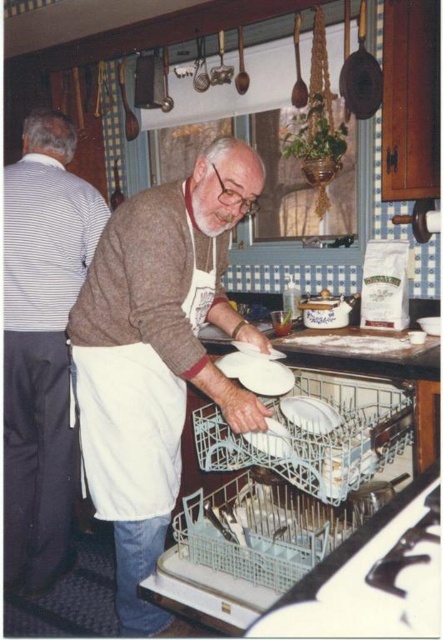
Is the position of white apron at left more distant than that of clear plastic dish washer at lower center?

That is True.

Does white apron at left have a lesser height compared to clear plastic dish washer at lower center?

No, white apron at left is not shorter than clear plastic dish washer at lower center.

The width and height of the screenshot is (443, 640). What do you see at coordinates (42, 344) in the screenshot?
I see `white apron at left` at bounding box center [42, 344].

This screenshot has width=443, height=640. What are the coordinates of `white apron at left` in the screenshot? It's located at (42, 344).

In the scene shown: Which of these two, brown wool sweater at center or clear plastic dish washer at lower center, stands taller?

With more height is brown wool sweater at center.

Does brown wool sweater at center appear on the right side of clear plastic dish washer at lower center?

Incorrect, brown wool sweater at center is not on the right side of clear plastic dish washer at lower center.

Between point (81, 364) and point (326, 545), which one is positioned behind?

The point (81, 364) is more distant.

The image size is (443, 640). I want to click on brown wool sweater at center, so click(156, 353).

Which is more to the right, clear plastic dish washer at lower center or white glossy platter at center?

white glossy platter at center is more to the right.

Can you confirm if clear plastic dish washer at lower center is taller than white glossy platter at center?

Correct, clear plastic dish washer at lower center is much taller as white glossy platter at center.

Is point (380, 426) positioned after point (304, 424)?

No, (380, 426) is closer to viewer.

Where is `clear plastic dish washer at lower center`? This screenshot has height=640, width=443. clear plastic dish washer at lower center is located at coordinates (244, 538).